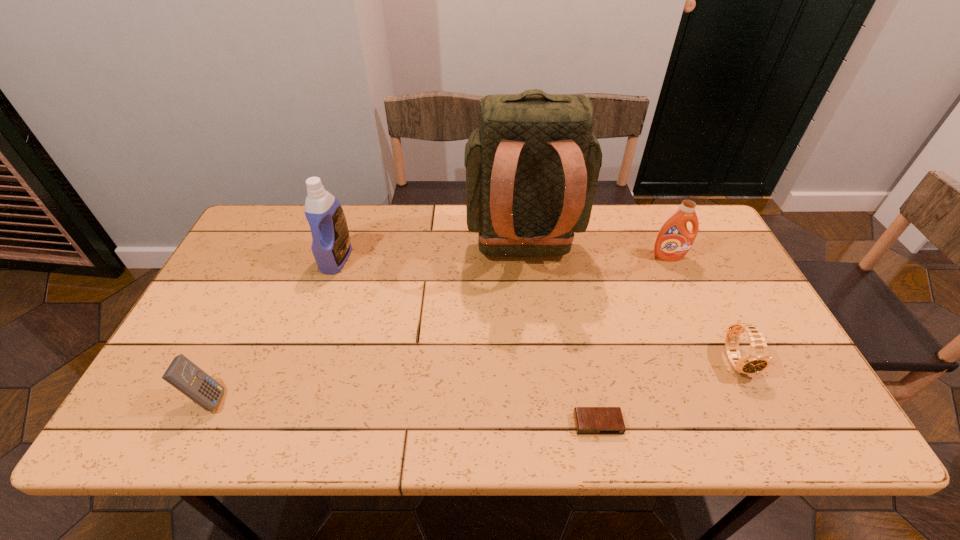
The height and width of the screenshot is (540, 960). I want to click on watch that is at the right edge, so click(757, 359).

Locate an element on the screen. object that is at the near left corner is located at coordinates (183, 374).

Where is `free region at the far edge of the desktop`? The height and width of the screenshot is (540, 960). free region at the far edge of the desktop is located at coordinates (392, 227).

Where is `free space at the near edge of the desktop`? free space at the near edge of the desktop is located at coordinates (690, 428).

In the image, there is a desktop. Where is `vacant space at the left edge`? The height and width of the screenshot is (540, 960). vacant space at the left edge is located at coordinates (218, 346).

What are the coordinates of `vacant space at the far right corner` in the screenshot? It's located at (658, 207).

Where is `free space that is in between the watch and the calculator`? The image size is (960, 540). free space that is in between the watch and the calculator is located at coordinates (472, 380).

The image size is (960, 540). Find the location of `free space between the fifth tallest object and the leftmost object`. free space between the fifth tallest object and the leftmost object is located at coordinates (472, 380).

You are a GUI agent. You are given a task and a screenshot of the screen. Output one action in this format:
    pyautogui.click(x=<x>, y=<y>)
    Task: Click on the vacant space that's between the alarm clock and the fourth farthest object
    This screenshot has width=960, height=540.
    Given the screenshot: What is the action you would take?
    pyautogui.click(x=667, y=392)

At what (x,y) coordinates should I click in order to perform the action: click on blank region between the shorter detergent and the calculator. Please return your answer as a coordinate pair (x, y). The height and width of the screenshot is (540, 960). Looking at the image, I should click on (438, 328).